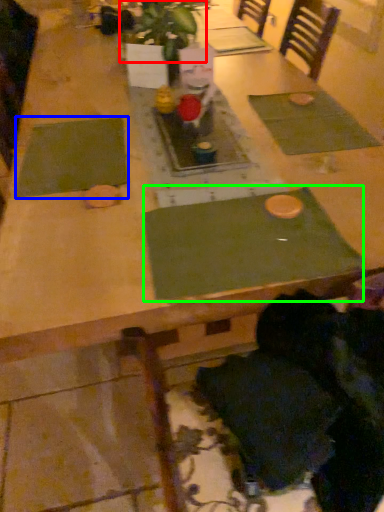
Question: Estimate the real-world distances between objects in this image. Which object is closer to plant (highlighted by a red box), place mat (highlighted by a blue box) or place mat (highlighted by a green box)?

Choices:
 (A) place mat
 (B) place mat

Answer: (A)